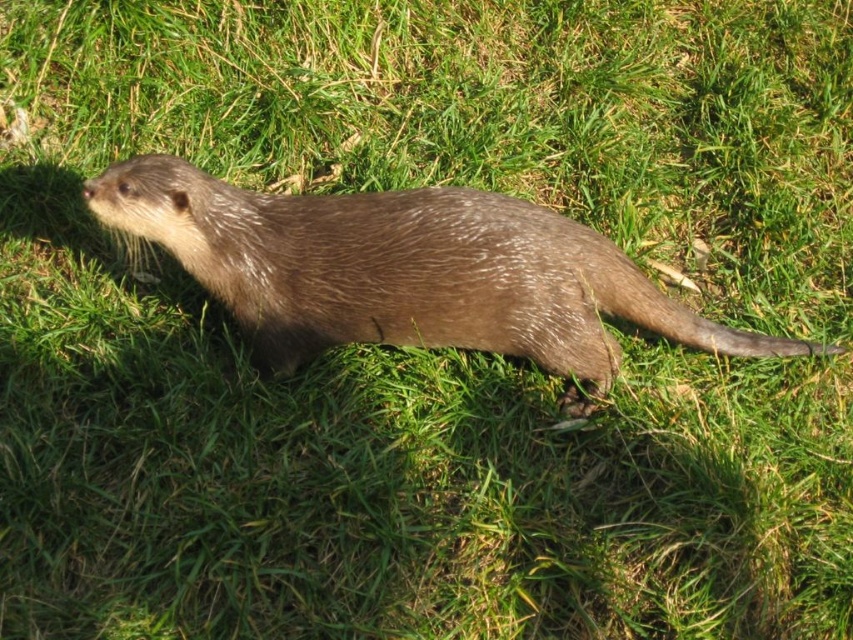
You are an animal caretaker observing an otter in its enclosure. You notice the brown furry otter at center and the brown furry tail at lower right. Which object is wider?

The brown furry otter at center is wider than the brown furry tail at lower right.

You are a wildlife photographer observing an otter in its natural habitat. You need to determine which object in the scene is bigger for your photo composition. Which one is larger between the brown furry otter at center and the brown furry tail at lower right?

The brown furry otter at center is larger in size than the brown furry tail at lower right.

You are a wildlife photographer trying to capture a clear photo of the brown furry otter at center and the brown furry tail at lower right. However, the tail is partially blocking the view of the otter. Can you adjust your position so that the tail no longer covers the otter?

The brown furry otter at center is positioned over the brown furry tail at lower right, so moving your camera position slightly to the left or right might allow you to capture the otter without the tail blocking it.